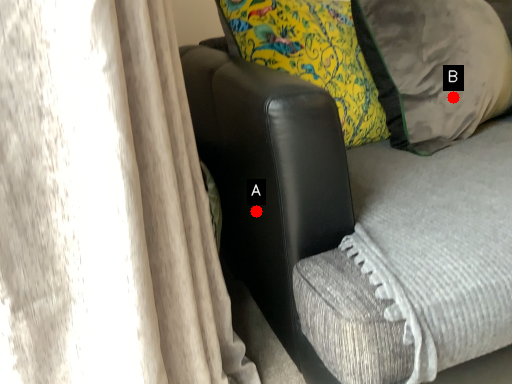
Question: Two points are circled on the image, labeled by A and B beside each circle. Which point is farther from the camera taking this photo?

Choices:
 (A) A is further
 (B) B is further

Answer: (B)